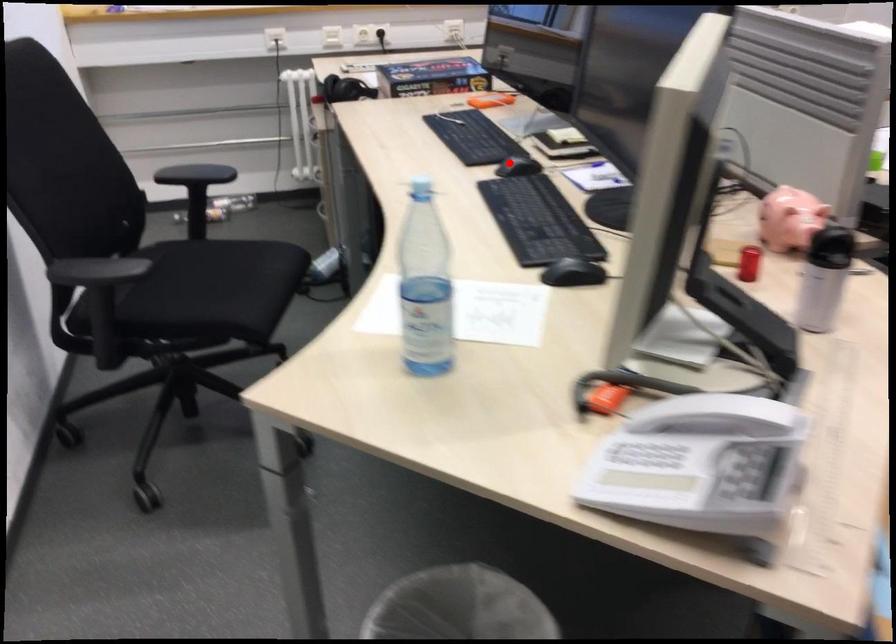
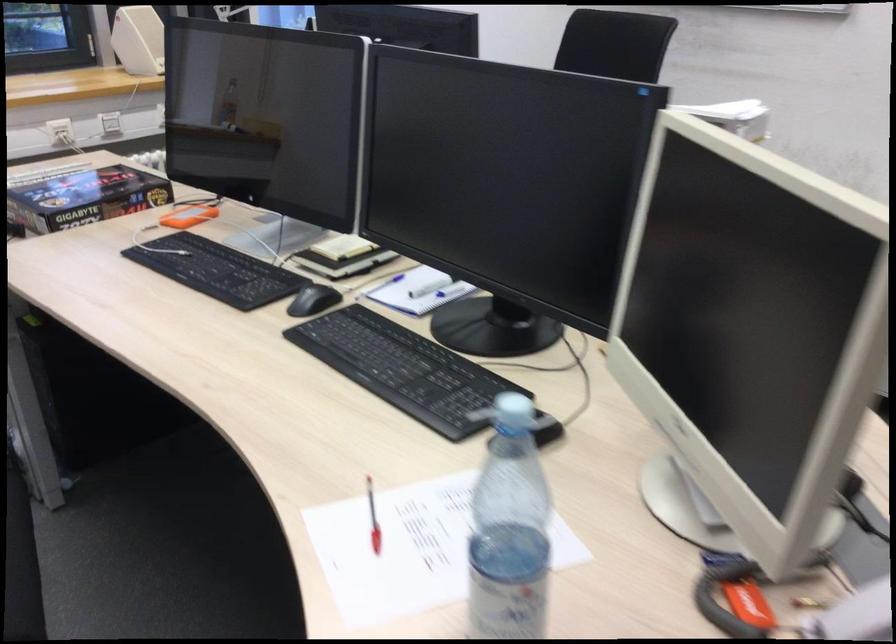
Where in the second image is the point corresponding to the highlighted location from the first image?

(313, 299)